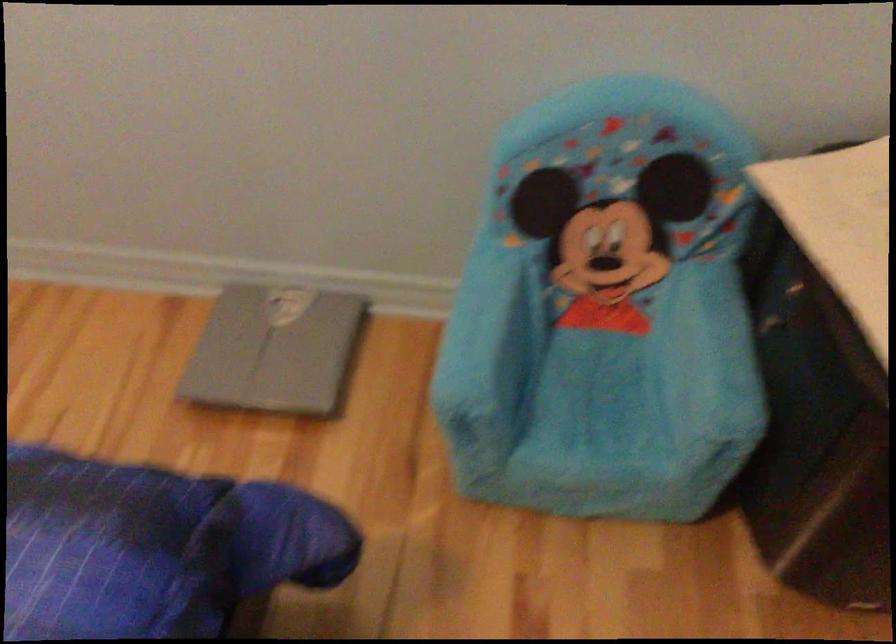
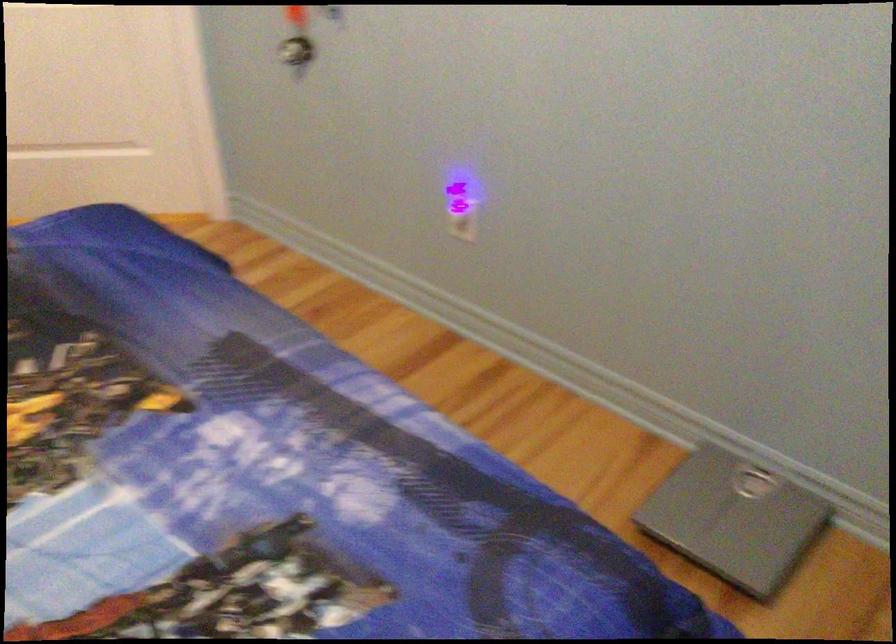
The point at (273, 351) is marked in the first image. Where is the corresponding point in the second image?

(735, 520)